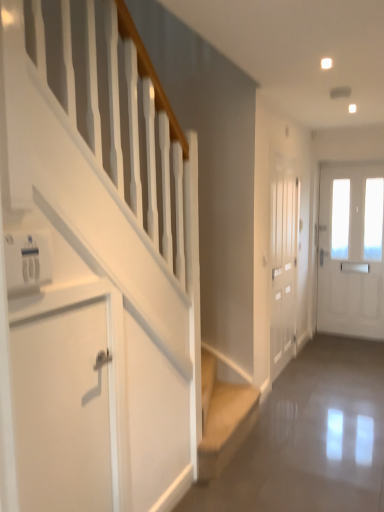
What do you see at coordinates (62, 410) in the screenshot? This screenshot has width=384, height=512. I see `white matte door at lower left, which is counted as the third door, starting from the back` at bounding box center [62, 410].

Describe the element at coordinates (351, 251) in the screenshot. The image size is (384, 512). I see `white glossy door at right, which appears as the first door when viewed from the back` at that location.

What do you see at coordinates (283, 266) in the screenshot? I see `white frosted glass door at center, positioned as the second door in right-to-left order` at bounding box center [283, 266].

This screenshot has width=384, height=512. Identify the location of white frosted glass door at center, positioned as the second door in right-to-left order. (283, 266).

Find the location of a particular element. The height and width of the screenshot is (512, 384). white matte door at lower left, marked as the 1th door in a left-to-right arrangement is located at coordinates (62, 410).

Is white matte door at lower left, which is counted as the 1th door, starting from the front, directly adjacent to beige fabric stairs at lower center?

No, white matte door at lower left, which is counted as the 1th door, starting from the front, is not with beige fabric stairs at lower center.

Find the location of a particular element. stairs behind the white matte door at lower left, which is counted as the third door, starting from the back is located at coordinates (223, 418).

Measure the distance from white matte door at lower left, positioned as the third door in right-to-left order, to beige fabric stairs at lower center.

A distance of 3.52 feet exists between white matte door at lower left, positioned as the third door in right-to-left order, and beige fabric stairs at lower center.

From the picture: What's the angular difference between white glossy door at right, the third door when ordered from front to back, and white frosted glass door at center, which is counted as the second door, starting from the front,'s facing directions?

They differ by 90 degrees in their facing directions.

Is white glossy door at right, the third door when ordered from front to back, thinner than white frosted glass door at center, which ranks as the second door in back-to-front order?

Indeed, white glossy door at right, the third door when ordered from front to back, has a lesser width compared to white frosted glass door at center, which ranks as the second door in back-to-front order.

Is white frosted glass door at center, which is counted as the second door, starting from the front, surrounded by white glossy door at right, marked as the third door in a left-to-right arrangement?

No, white glossy door at right, marked as the third door in a left-to-right arrangement, does not contain white frosted glass door at center, which is counted as the second door, starting from the front.

Based on the photo, considering their positions, is white glossy door at right, which appears as the first door when viewed from the back, located in front of or behind white frosted glass door at center, which ranks as the second door in back-to-front order?

white glossy door at right, which appears as the first door when viewed from the back, is positioned farther from the viewer than white frosted glass door at center, which ranks as the second door in back-to-front order.

Is point (36, 506) positioned in front of point (281, 181)?

That is True.

Do you think white matte door at lower left, marked as the 1th door in a left-to-right arrangement, is within white frosted glass door at center, positioned as the second door in right-to-left order, or outside of it?

white matte door at lower left, marked as the 1th door in a left-to-right arrangement, is spatially situated outside white frosted glass door at center, positioned as the second door in right-to-left order.

Is white matte door at lower left, which is counted as the 1th door, starting from the front, aimed at white frosted glass door at center, which ranks as the second door in back-to-front order?

No, white matte door at lower left, which is counted as the 1th door, starting from the front, is not oriented towards white frosted glass door at center, which ranks as the second door in back-to-front order.

Is white matte door at lower left, which is counted as the 1th door, starting from the front, next to white frosted glass door at center, which is counted as the second door, starting from the front, and touching it?

No, white matte door at lower left, which is counted as the 1th door, starting from the front, is not making contact with white frosted glass door at center, which is counted as the second door, starting from the front.

Considering the sizes of white frosted glass door at center, which ranks as the second door in back-to-front order, and beige fabric stairs at lower center in the image, is white frosted glass door at center, which ranks as the second door in back-to-front order, taller or shorter than beige fabric stairs at lower center?

Considering their sizes, white frosted glass door at center, which ranks as the second door in back-to-front order, has more height than beige fabric stairs at lower center.

How much distance is there between white frosted glass door at center, which ranks as the second door in back-to-front order, and beige fabric stairs at lower center?

The distance of white frosted glass door at center, which ranks as the second door in back-to-front order, from beige fabric stairs at lower center is 1.06 meters.

Is the position of white frosted glass door at center, which ranks as the second door in back-to-front order, less distant than that of beige fabric stairs at lower center?

No, white frosted glass door at center, which ranks as the second door in back-to-front order, is further to the viewer.

In the scene shown: Is white frosted glass door at center, positioned as the second door in right-to-left order, positioned with its back to beige fabric stairs at lower center?

That's not correct — white frosted glass door at center, positioned as the second door in right-to-left order, is not looking away from beige fabric stairs at lower center.

From a real-world perspective, is beige fabric stairs at lower center physically below white frosted glass door at center, which is the 2th door from left to right?

Yes, from a real-world perspective, beige fabric stairs at lower center is under white frosted glass door at center, which is the 2th door from left to right.

The width and height of the screenshot is (384, 512). I want to click on stairs that appears below the white frosted glass door at center, which is the 2th door from left to right (from the image's perspective), so click(x=223, y=418).

The image size is (384, 512). In order to click on door behind the white frosted glass door at center, positioned as the second door in right-to-left order in this screenshot , I will do `click(351, 251)`.

From a real-world perspective, who is located higher, white frosted glass door at center, which is the 2th door from left to right, or white glossy door at right, marked as the third door in a left-to-right arrangement?

white frosted glass door at center, which is the 2th door from left to right.

Considering the positions of points (285, 271) and (368, 207), is point (285, 271) farther from camera compared to point (368, 207)?

No, (285, 271) is closer to viewer.

Is white frosted glass door at center, which is the 2th door from left to right, spatially inside white glossy door at right, marked as the third door in a left-to-right arrangement, or outside of it?

white frosted glass door at center, which is the 2th door from left to right, is not enclosed by white glossy door at right, marked as the third door in a left-to-right arrangement.

Can you see beige fabric stairs at lower center touching white matte door at lower left, positioned as the third door in right-to-left order?

No, beige fabric stairs at lower center is not next to white matte door at lower left, positioned as the third door in right-to-left order.

Is white matte door at lower left, marked as the 1th door in a left-to-right arrangement, surrounded by beige fabric stairs at lower center?

No.

Does point (215, 385) come behind point (101, 372)?

Yes, it is.

The width and height of the screenshot is (384, 512). Identify the location of stairs behind the white matte door at lower left, positioned as the third door in right-to-left order. (223, 418).

Where is `door located above the white glossy door at right, which appears as the first door when viewed from the back (from a real-world perspective)`? This screenshot has width=384, height=512. door located above the white glossy door at right, which appears as the first door when viewed from the back (from a real-world perspective) is located at coordinates (283, 266).

From the picture: Considering their positions, is white frosted glass door at center, which ranks as the second door in back-to-front order, positioned further to white matte door at lower left, positioned as the third door in right-to-left order, than white glossy door at right, the third door when ordered from front to back?

white glossy door at right, the third door when ordered from front to back, is positioned further to the anchor white matte door at lower left, positioned as the third door in right-to-left order.

In the scene shown: From the image, which object appears to be nearer to white matte door at lower left, which is counted as the 1th door, starting from the front, beige fabric stairs at lower center or white frosted glass door at center, positioned as the second door in right-to-left order?

Among the two, beige fabric stairs at lower center is located nearer to white matte door at lower left, which is counted as the 1th door, starting from the front.

Considering their positions, is white matte door at lower left, marked as the 1th door in a left-to-right arrangement, positioned further to white glossy door at right, the third door when ordered from front to back, than white frosted glass door at center, which is counted as the second door, starting from the front?

Based on the image, white matte door at lower left, marked as the 1th door in a left-to-right arrangement, appears to be further to white glossy door at right, the third door when ordered from front to back.

Based on their spatial positions, is beige fabric stairs at lower center or white frosted glass door at center, positioned as the second door in right-to-left order, closer to white glossy door at right, which is counted as the 1th door, starting from the right?

The object closer to white glossy door at right, which is counted as the 1th door, starting from the right, is white frosted glass door at center, positioned as the second door in right-to-left order.

Looking at the image, which one is located further to white glossy door at right, which appears as the first door when viewed from the back, white frosted glass door at center, which ranks as the second door in back-to-front order, or beige fabric stairs at lower center?

beige fabric stairs at lower center is positioned further to the anchor white glossy door at right, which appears as the first door when viewed from the back.

Considering their positions, is white frosted glass door at center, which is counted as the second door, starting from the front, positioned further to white matte door at lower left, which is counted as the third door, starting from the back, than beige fabric stairs at lower center?

white frosted glass door at center, which is counted as the second door, starting from the front, is further to white matte door at lower left, which is counted as the third door, starting from the back.

Considering their positions, is white glossy door at right, which is counted as the 1th door, starting from the right, positioned closer to white frosted glass door at center, which ranks as the second door in back-to-front order, than beige fabric stairs at lower center?

beige fabric stairs at lower center lies closer to white frosted glass door at center, which ranks as the second door in back-to-front order, than the other object.

Based on their spatial positions, is white matte door at lower left, which is counted as the 1th door, starting from the front, or beige fabric stairs at lower center closer to white frosted glass door at center, positioned as the second door in right-to-left order?

Among the two, beige fabric stairs at lower center is located nearer to white frosted glass door at center, positioned as the second door in right-to-left order.

Identify the location of stairs located between white matte door at lower left, marked as the 1th door in a left-to-right arrangement, and white frosted glass door at center, which is counted as the second door, starting from the front, in the depth direction. Image resolution: width=384 pixels, height=512 pixels. (223, 418).

At what (x,y) coordinates should I click in order to perform the action: click on door located between beige fabric stairs at lower center and white glossy door at right, the third door when ordered from front to back, in the depth direction. Please return your answer as a coordinate pair (x, y). The height and width of the screenshot is (512, 384). Looking at the image, I should click on click(x=283, y=266).

The image size is (384, 512). What are the coordinates of `stairs between white matte door at lower left, which is counted as the third door, starting from the back, and white glossy door at right, which is counted as the 1th door, starting from the right, along the z-axis` in the screenshot? It's located at (223, 418).

This screenshot has width=384, height=512. Find the location of `door between white matte door at lower left, which is counted as the third door, starting from the back, and white glossy door at right, marked as the third door in a left-to-right arrangement, from front to back`. door between white matte door at lower left, which is counted as the third door, starting from the back, and white glossy door at right, marked as the third door in a left-to-right arrangement, from front to back is located at coordinates (283, 266).